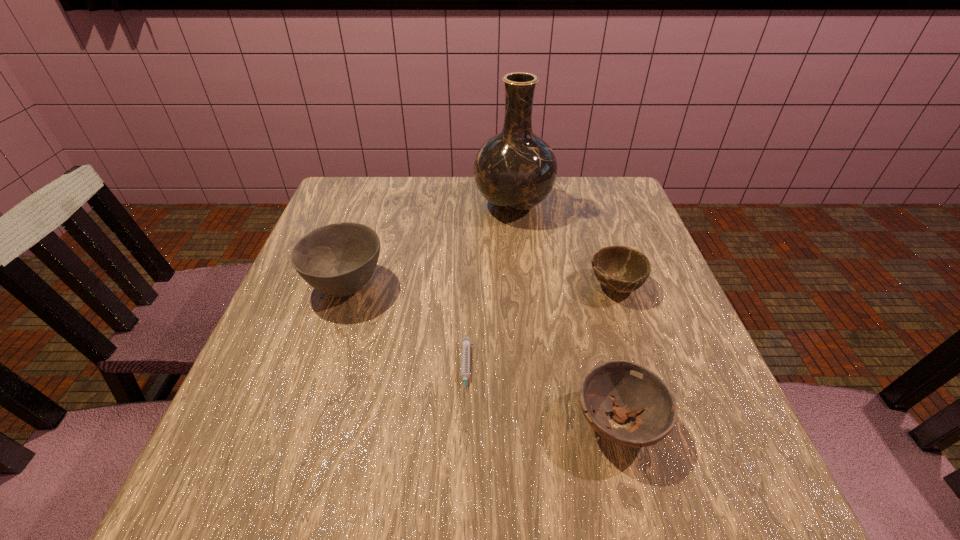
Locate an element on the screen. Image resolution: width=960 pixels, height=540 pixels. object that is at the far edge is located at coordinates (515, 170).

The image size is (960, 540). I want to click on object that is at the near edge, so click(627, 389).

Find the location of a particular element. The height and width of the screenshot is (540, 960). object that is at the left edge is located at coordinates (339, 259).

Locate an element on the screen. The width and height of the screenshot is (960, 540). object that is at the near right corner is located at coordinates (627, 389).

Find the location of a particular element. This screenshot has height=540, width=960. vacant region at the far edge of the desktop is located at coordinates (413, 198).

In the image, there is a desktop. Where is `vacant region at the left edge`? The image size is (960, 540). vacant region at the left edge is located at coordinates (272, 442).

The image size is (960, 540). What are the coordinates of `free space at the right edge of the desktop` in the screenshot? It's located at (633, 356).

In the image, there is a desktop. Identify the location of vacant space at the far left corner. coord(326,220).

At what (x,y) coordinates should I click in order to perform the action: click on free region at the near left corner of the desktop. Please return your answer as a coordinate pair (x, y). Image resolution: width=960 pixels, height=540 pixels. Looking at the image, I should click on (261, 463).

Image resolution: width=960 pixels, height=540 pixels. Identify the location of vacant area at the far right corner of the desktop. (584, 193).